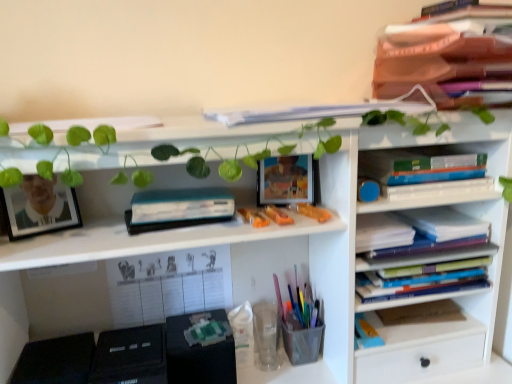
Question: Is the depth of translucent plastic toy at upper center less than that of matte orange book at upper right, which is the first book in top-to-bottom order?

Choices:
 (A) no
 (B) yes

Answer: (A)

Question: Would you say translucent plastic toy at upper center is outside matte orange book at upper right, which is the 9th book from bottom to top?

Choices:
 (A) yes
 (B) no

Answer: (A)

Question: Can you confirm if translucent plastic toy at upper center is positioned to the right of matte orange book at upper right, which is the 9th book from bottom to top?

Choices:
 (A) yes
 (B) no

Answer: (B)

Question: Is translucent plastic toy at upper center bigger than matte orange book at upper right, which is the first book in top-to-bottom order?

Choices:
 (A) yes
 (B) no

Answer: (B)

Question: Is matte orange book at upper right, which is the first book in top-to-bottom order, at the back of translucent plastic toy at upper center?

Choices:
 (A) no
 (B) yes

Answer: (A)

Question: Looking at the image, does translucent plastic pen holder at center seem bigger or smaller compared to matte black picture frame at left?

Choices:
 (A) small
 (B) big

Answer: (A)

Question: In terms of height, does translucent plastic pen holder at center look taller or shorter compared to matte black picture frame at left?

Choices:
 (A) tall
 (B) short

Answer: (B)

Question: From the image's perspective, relative to matte black picture frame at left, is translucent plastic pen holder at center above or below?

Choices:
 (A) below
 (B) above

Answer: (A)

Question: Considering the relative positions of translucent plastic pen holder at center and matte black picture frame at left in the image provided, is translucent plastic pen holder at center to the left or to the right of matte black picture frame at left?

Choices:
 (A) right
 (B) left

Answer: (A)

Question: Is matte black picture frame at left spatially inside blue hardcover book at right, acting as the 5th book starting from the top, or outside of it?

Choices:
 (A) outside
 (B) inside

Answer: (A)

Question: Is matte black picture frame at left bigger or smaller than blue hardcover book at right, acting as the 5th book starting from the top?

Choices:
 (A) small
 (B) big

Answer: (B)

Question: In terms of width, does matte black picture frame at left look wider or thinner when compared to blue hardcover book at right, acting as the 5th book starting from the top?

Choices:
 (A) thin
 (B) wide

Answer: (A)

Question: Is matte black picture frame at left in front of or behind blue hardcover book at right, which ranks as the fifth book in bottom-to-top order, in the image?

Choices:
 (A) behind
 (B) front

Answer: (B)

Question: Is blue hardcover book at right, which ranks as the fifth book in bottom-to-top order, in front of or behind blue hardcover book at center right, the 4th book when ordered from top to bottom, in the image?

Choices:
 (A) front
 (B) behind

Answer: (A)

Question: Is point (430, 241) positioned closer to the camera than point (446, 226)?

Choices:
 (A) farther
 (B) closer

Answer: (B)